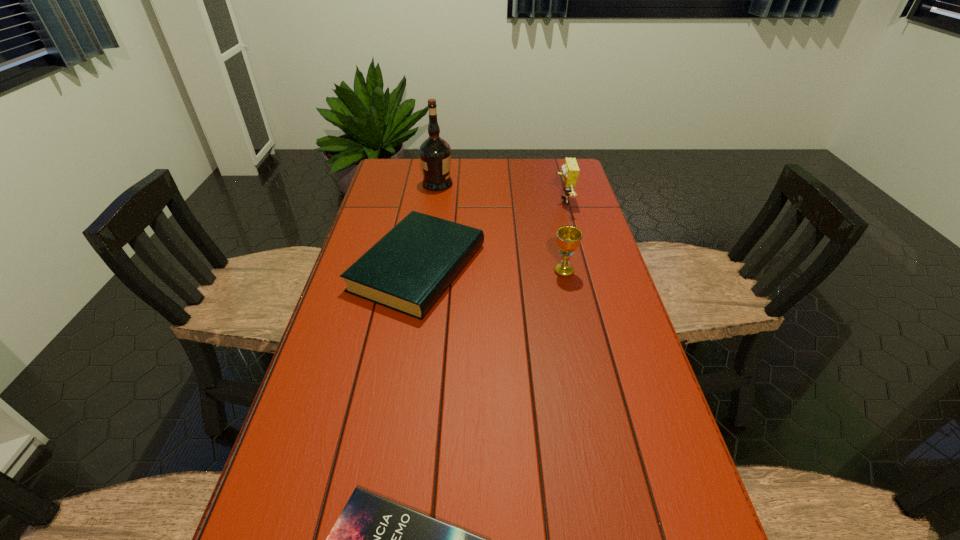
You are a GUI agent. You are given a task and a screenshot of the screen. Output one action in this format:
    pyautogui.click(x=<x>, y=<y>)
    Task: Click on the tallest object
    This screenshot has width=960, height=540.
    Given the screenshot: What is the action you would take?
    pyautogui.click(x=435, y=153)

Find the location of `sponge`. sponge is located at coordinates (570, 170).

Find the location of a particular element. chalice is located at coordinates (568, 237).

Locate an element on the screen. The image size is (960, 540). the farther hardback book is located at coordinates (408, 270).

Identify the location of the taller hardback book. This screenshot has width=960, height=540. (408, 270).

At what (x,y) coordinates should I click in order to perform the action: click on vacant space situated on the surface of the tallest object. Please return your answer as a coordinate pair (x, y). Looking at the image, I should click on (517, 184).

This screenshot has height=540, width=960. Identify the location of vacant space located on the face of the sponge. (477, 201).

This screenshot has width=960, height=540. I want to click on vacant space positioned on the face of the sponge, so click(x=492, y=201).

Where is `vacant region located 0.300m on the face of the sponge`? vacant region located 0.300m on the face of the sponge is located at coordinates (468, 201).

This screenshot has width=960, height=540. Identify the location of vacant space situated on the back of the chalice. (559, 247).